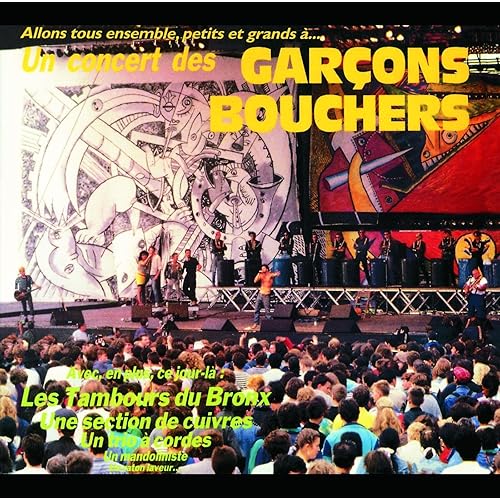
Where is `speakers on the front stage`? speakers on the front stage is located at coordinates (340, 335), (340, 315), (283, 337), (280, 306), (222, 326), (179, 310), (137, 312), (66, 318), (442, 335).